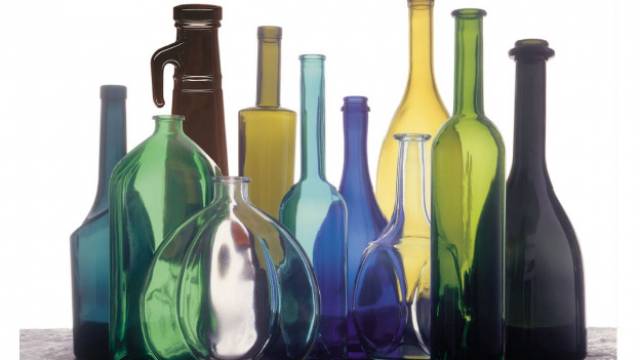
I want to click on five most right glass bottles, so click(x=356, y=193), click(x=412, y=247), click(x=417, y=99), click(x=459, y=163), click(x=520, y=201).